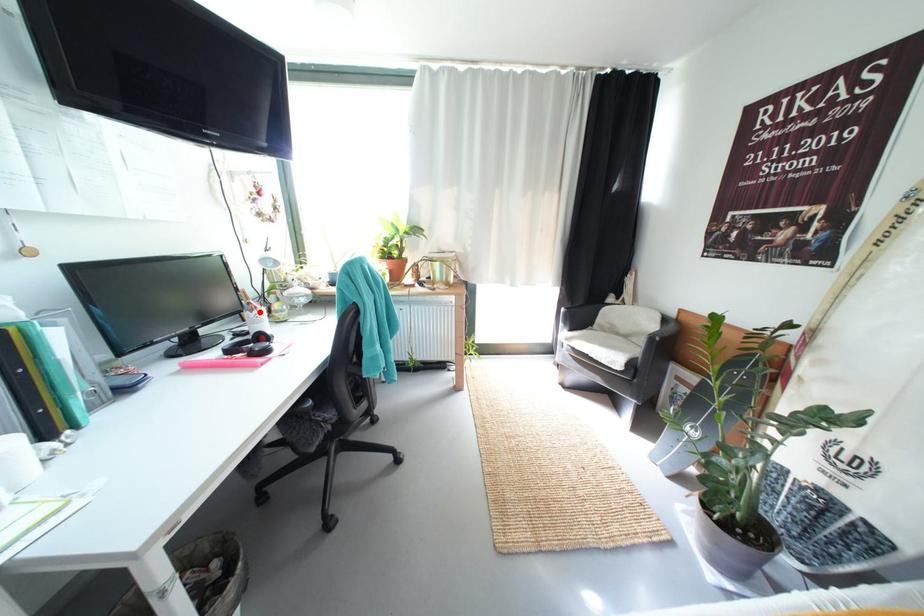
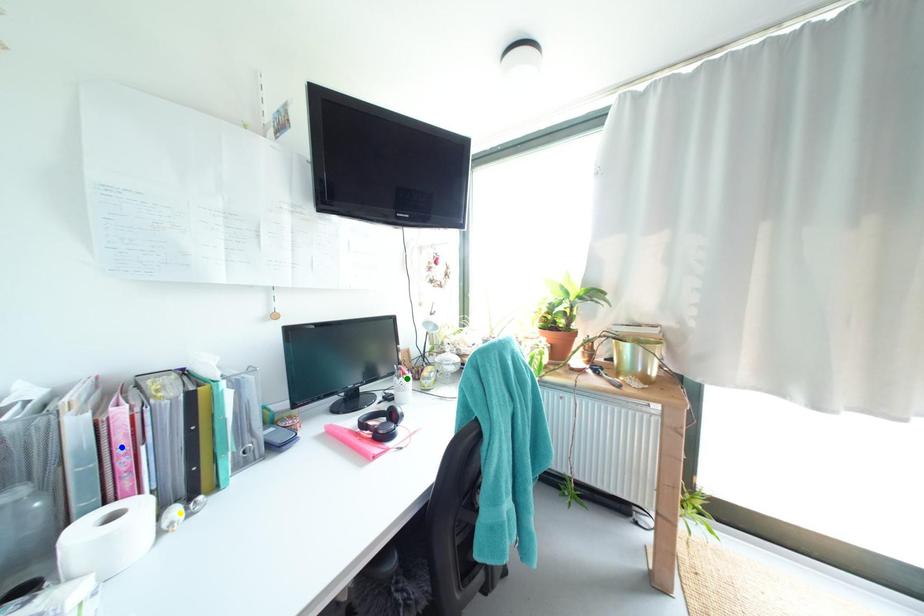
Question: I am providing you with two images of the same scene from different viewpoints. A red point is marked on the first image. You are given multiple points on the second image. Which mark in image 2 goes with the point in image 1?

Choices:
 (A) green point
 (B) yellow point
 (C) blue point

Answer: (A)